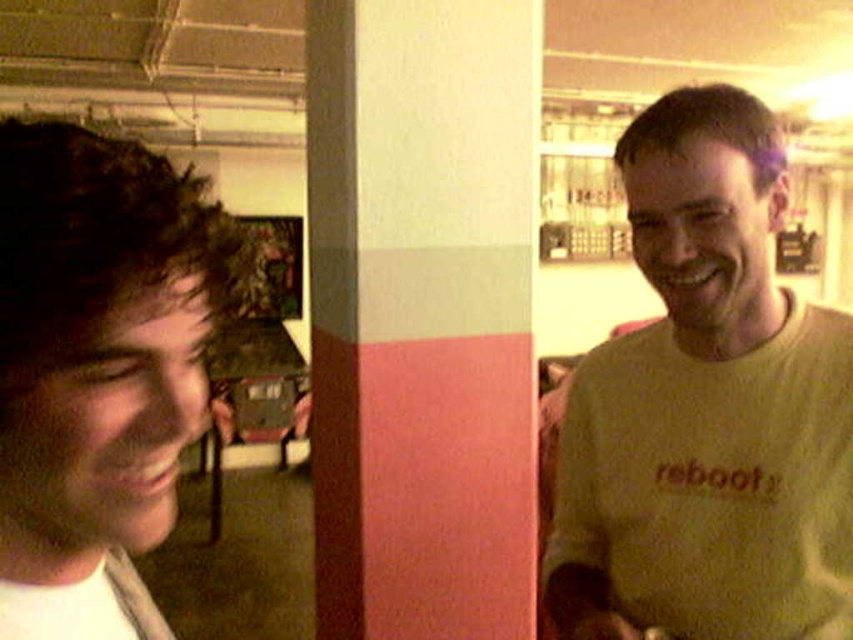
Question: Is yellow cotton t-shirt at right below matte black hair at left?

Choices:
 (A) yes
 (B) no

Answer: (A)

Question: Does yellow cotton t-shirt at right appear on the right side of matte black hair at left?

Choices:
 (A) yes
 (B) no

Answer: (A)

Question: Which point is closer to the camera?

Choices:
 (A) matte black hair at left
 (B) yellow cotton t-shirt at right

Answer: (A)

Question: Which of the following is the closest to the observer?

Choices:
 (A) (28, 227)
 (B) (657, 385)

Answer: (A)

Question: Is the position of yellow cotton t-shirt at right more distant than that of matte black hair at left?

Choices:
 (A) yes
 (B) no

Answer: (A)